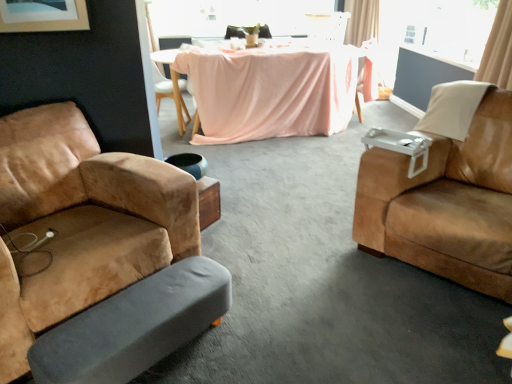
Locate an element on the screen. This screenshot has width=512, height=384. vacant area that lies between gray fabric footrest at lower left and suede brown couch at right, which appears as the 2th chair when viewed from the right is located at coordinates (337, 314).